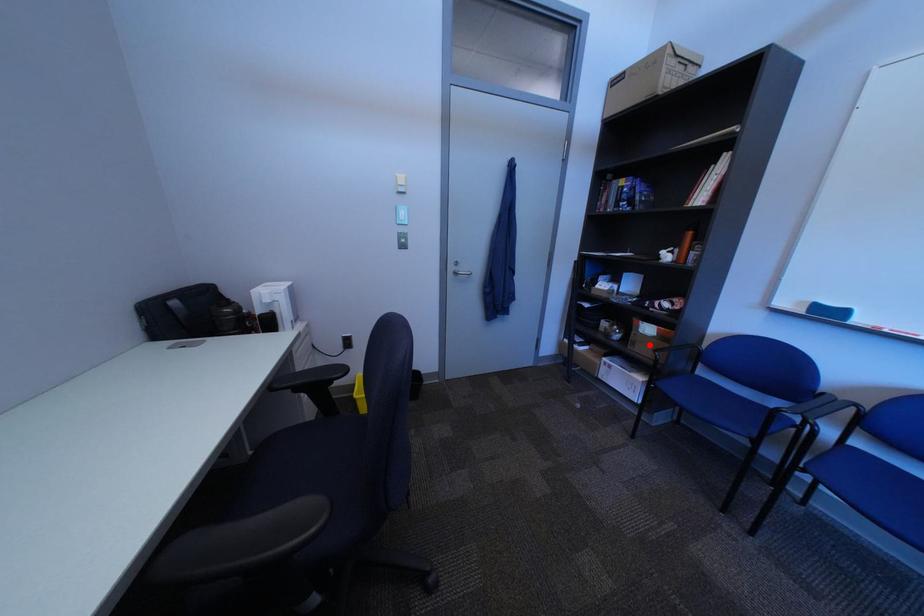
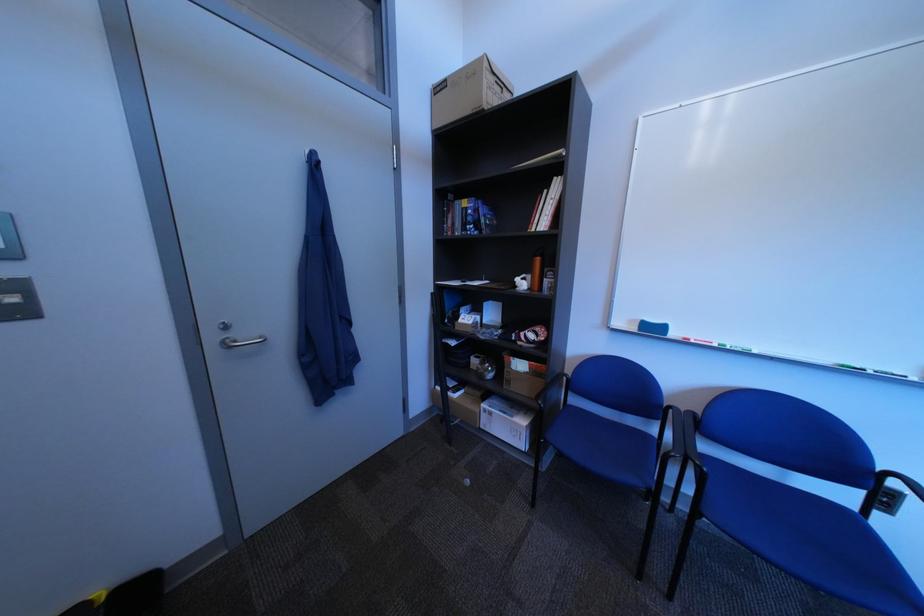
Question: I am providing you with two images of the same scene from different viewpoints. Image1 has a red point marked. In image2, the corresponding 3D location appears at what relative position? Reply with the corresponding letter.

Choices:
 (A) Closer
 (B) Farther

Answer: (B)